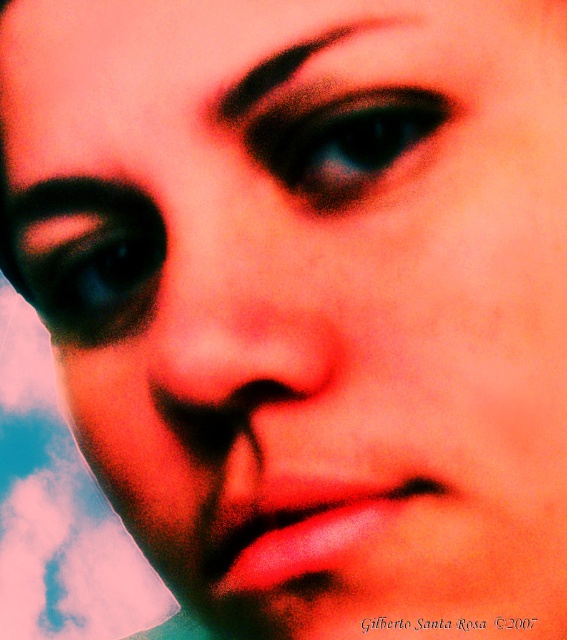
In the scene shown: You are an artist analyzing a portrait. You notice two elements in the image, the black glittery eye at center and the matte black eye at upper left. Which of these two elements is smaller in size?

The black glittery eye at center is smaller than the matte black eye at upper left according to the description.

From the picture: You are a makeup artist analyzing the portrait. You notice the matte red nose at center and the black glittery eye at center. Which object is positioned closer to your viewpoint?

The matte red nose at center is closer to the viewer than the black glittery eye at center.

You are holding a camera and want to take a photo of the person in the image. The camera has a focus point at point (x=304, y=116). If the camera requires the subject to be at least 10 inches away to focus properly, will the camera be able to focus on the subject?

Point (x=304, y=116) is only 8.32 inches away from the viewer, which is less than the required 10 inches. Therefore, the camera will not be able to focus on the subject.